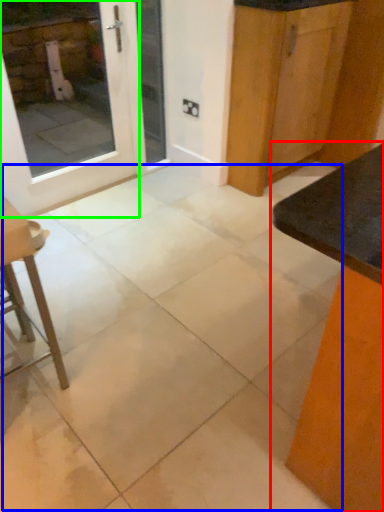
Question: Which object is the closest to the table (highlighted by a red box)? Choose among these: concrete (highlighted by a blue box) or door (highlighted by a green box).

Choices:
 (A) concrete
 (B) door

Answer: (A)